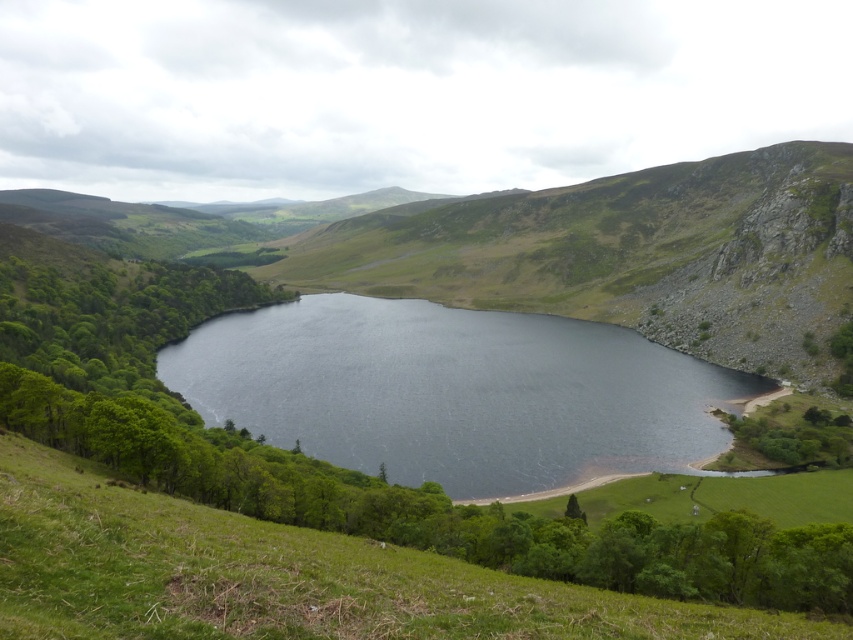
Is dark blue water at center taller than green grassy hillside at lower center?

Yes.

Is dark blue water at center wider than green grassy hillside at lower center?

Correct, the width of dark blue water at center exceeds that of green grassy hillside at lower center.

Image resolution: width=853 pixels, height=640 pixels. Describe the element at coordinates (456, 392) in the screenshot. I see `dark blue water at center` at that location.

Identify the location of dark blue water at center. This screenshot has height=640, width=853. [456, 392].